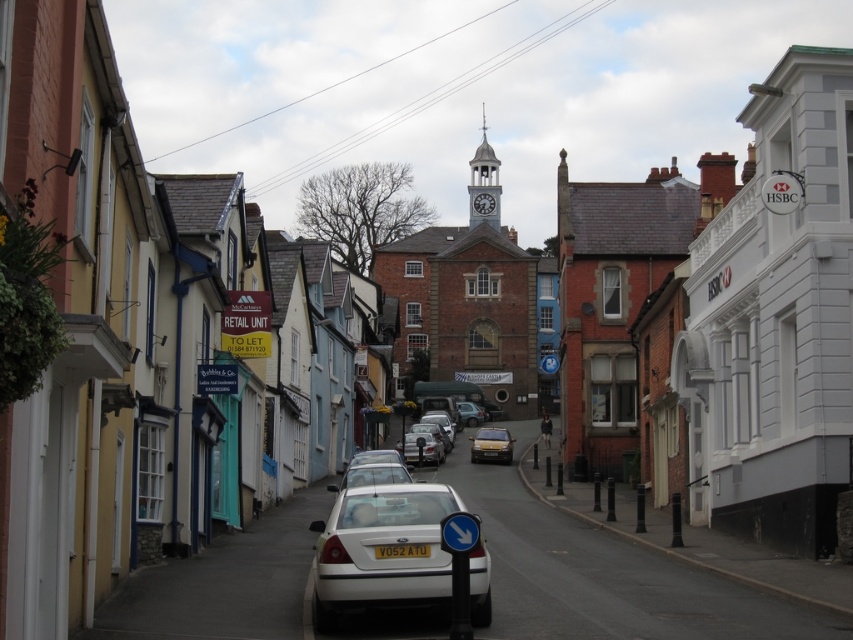
You are standing on the street in the image and want to walk towards both the point at coordinates (439,497) and the point at coordinates (477,429). Which point will you reach first?

You will reach the point at coordinates (439,497) first because it is closer to you than the point at coordinates (477,429).

You are a delivery driver who needs to park your van, which is 7 meters long, between the white matte sedan at center and the gold metallic car at center. Is there enough space to park your van without overlapping either vehicle?

The distance between the white matte sedan at center and the gold metallic car at center is 67.36 meters. Since your van is only 7 meters long, there is ample space to park between them without overlapping either vehicle.